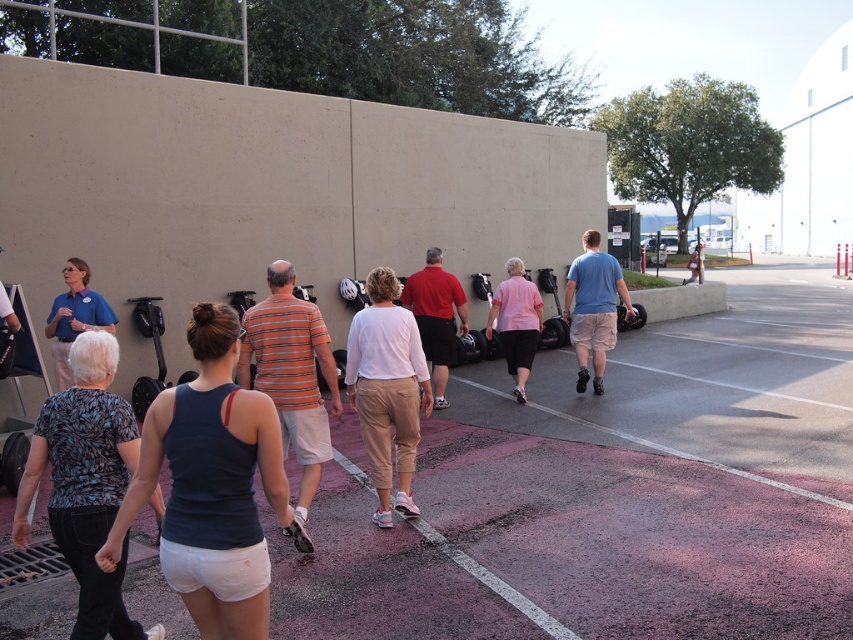
Is printed fabric blouse at lower left further to camera compared to pink asphalt at lower center?

No, printed fabric blouse at lower left is in front of pink asphalt at lower center.

Is printed fabric blouse at lower left to the left of pink asphalt at lower center from the viewer's perspective?

Yes, printed fabric blouse at lower left is to the left of pink asphalt at lower center.

Which is in front, point (114, 480) or point (686, 452)?

Point (114, 480) is more forward.

Image resolution: width=853 pixels, height=640 pixels. Find the location of `printed fabric blouse at lower left`. printed fabric blouse at lower left is located at coordinates (86, 483).

Does blue fabric tank top at center have a lesser height compared to pink matte shirt at center?

Correct, blue fabric tank top at center is not as tall as pink matte shirt at center.

Is blue fabric tank top at center thinner than pink matte shirt at center?

In fact, blue fabric tank top at center might be wider than pink matte shirt at center.

What do you see at coordinates (212, 484) in the screenshot?
I see `blue fabric tank top at center` at bounding box center [212, 484].

Where is `blue fabric tank top at center`? blue fabric tank top at center is located at coordinates (212, 484).

Does orange striped shirt at center appear under pink matte shirt at center?

Indeed, orange striped shirt at center is positioned under pink matte shirt at center.

Between orange striped shirt at center and pink matte shirt at center, which one is positioned higher?

pink matte shirt at center

The image size is (853, 640). Describe the element at coordinates (292, 380) in the screenshot. I see `orange striped shirt at center` at that location.

This screenshot has height=640, width=853. I want to click on orange striped shirt at center, so click(x=292, y=380).